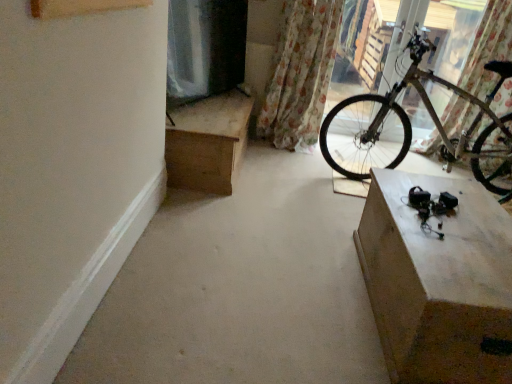
Question: Is floral fabric curtain at upper right, marked as the first curtain in a right-to-left arrangement, shorter than smooth concrete at center?

Choices:
 (A) no
 (B) yes

Answer: (A)

Question: Is floral fabric curtain at upper right, which appears as the 2th curtain when viewed from the left, at the left side of smooth concrete at center?

Choices:
 (A) yes
 (B) no

Answer: (B)

Question: Would you say floral fabric curtain at upper right, which appears as the 2th curtain when viewed from the left, contains smooth concrete at center?

Choices:
 (A) no
 (B) yes

Answer: (A)

Question: Considering the relative sizes of floral fabric curtain at upper right, marked as the first curtain in a right-to-left arrangement, and smooth concrete at center in the image provided, is floral fabric curtain at upper right, marked as the first curtain in a right-to-left arrangement, bigger than smooth concrete at center?

Choices:
 (A) no
 (B) yes

Answer: (A)

Question: Is floral fabric curtain at upper right, which appears as the 2th curtain when viewed from the left, next to smooth concrete at center and touching it?

Choices:
 (A) yes
 (B) no

Answer: (B)

Question: From the image's perspective, is floral fabric curtain at upper right, which appears as the 2th curtain when viewed from the left, over smooth concrete at center?

Choices:
 (A) yes
 (B) no

Answer: (A)

Question: Is wooden desk at upper left at the back of smooth concrete at center?

Choices:
 (A) no
 (B) yes

Answer: (A)

Question: Is smooth concrete at center thinner than wooden desk at upper left?

Choices:
 (A) yes
 (B) no

Answer: (B)

Question: Can you confirm if smooth concrete at center is positioned to the right of wooden desk at upper left?

Choices:
 (A) no
 (B) yes

Answer: (B)

Question: From the image's perspective, would you say smooth concrete at center is shown under wooden desk at upper left?

Choices:
 (A) yes
 (B) no

Answer: (A)

Question: Does smooth concrete at center have a lesser height compared to wooden desk at upper left?

Choices:
 (A) no
 (B) yes

Answer: (B)

Question: From a real-world perspective, is smooth concrete at center physically above wooden desk at upper left?

Choices:
 (A) yes
 (B) no

Answer: (B)

Question: Is wooden desk at upper left thinner than floral fabric curtain at upper right, which appears as the 2th curtain when viewed from the left?

Choices:
 (A) yes
 (B) no

Answer: (B)